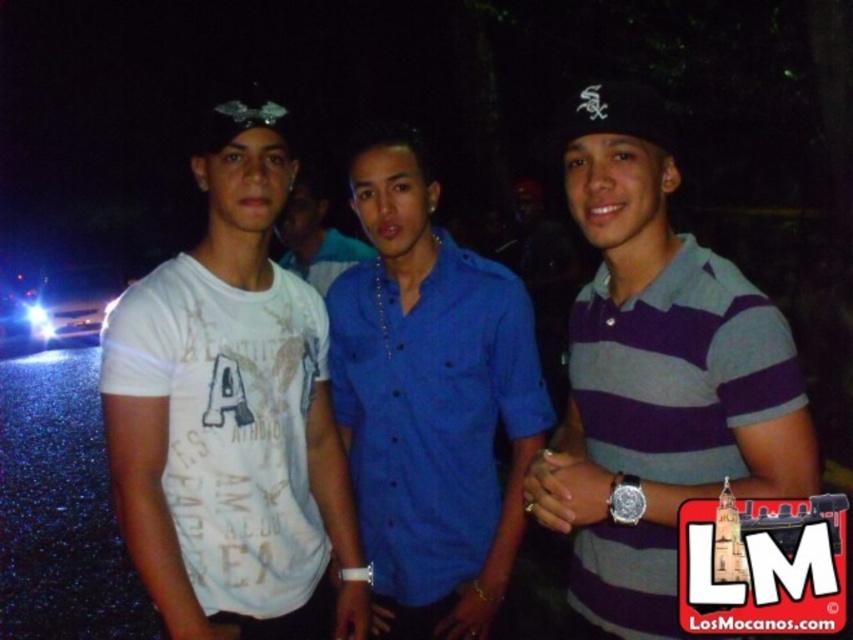
In the scene shown: Is white cotton t-shirt at left above blue button-up shirt at center?

No.

Measure the distance between white cotton t-shirt at left and camera.

white cotton t-shirt at left is 5.37 feet from camera.

Is point (241, 634) behind point (312, 227)?

No, (241, 634) is closer to viewer.

At what (x,y) coordinates should I click in order to perform the action: click on white cotton t-shirt at left. Please return your answer as a coordinate pair (x, y). This screenshot has width=853, height=640. Looking at the image, I should click on (231, 416).

Is point (350, 531) less distant than point (610, 448)?

No.

Is white cotton t-shirt at left to the right of purple striped polo shirt at center from the viewer's perspective?

No, white cotton t-shirt at left is not to the right of purple striped polo shirt at center.

The height and width of the screenshot is (640, 853). In order to click on white cotton t-shirt at left in this screenshot , I will do `click(231, 416)`.

Looking at this image, which is more to the right, purple striped polo shirt at center or matte blue polo shirt at center?

From the viewer's perspective, purple striped polo shirt at center appears more on the right side.

Is point (683, 362) in front of point (352, 428)?

That is True.

At what (x,y) coordinates should I click in order to perform the action: click on purple striped polo shirt at center. Please return your answer as a coordinate pair (x, y). This screenshot has width=853, height=640. Looking at the image, I should click on (654, 378).